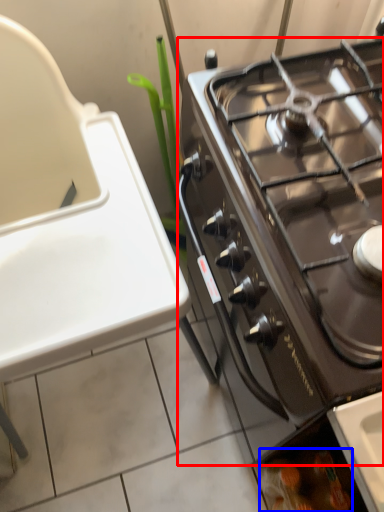
Question: Which object appears farthest to the camera in this image, gas stove (highlighted by a red box) or food (highlighted by a blue box)?

Choices:
 (A) gas stove
 (B) food

Answer: (B)